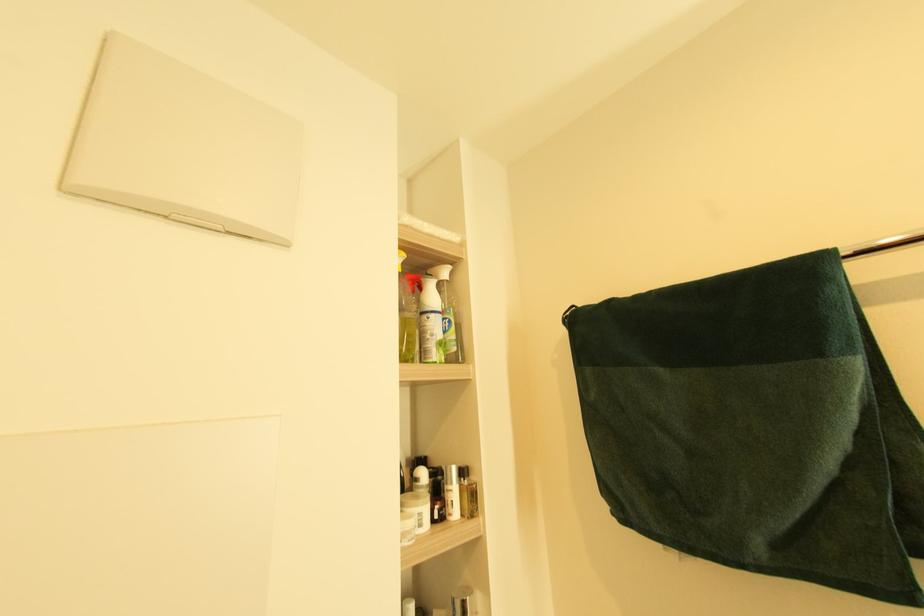
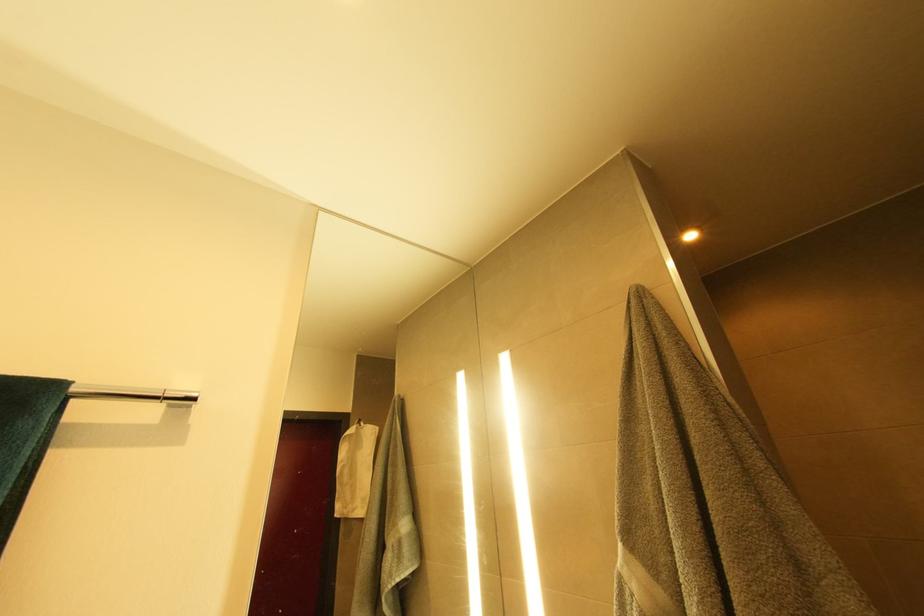
How did the camera likely rotate?

The rotation direction of the camera is right-up.